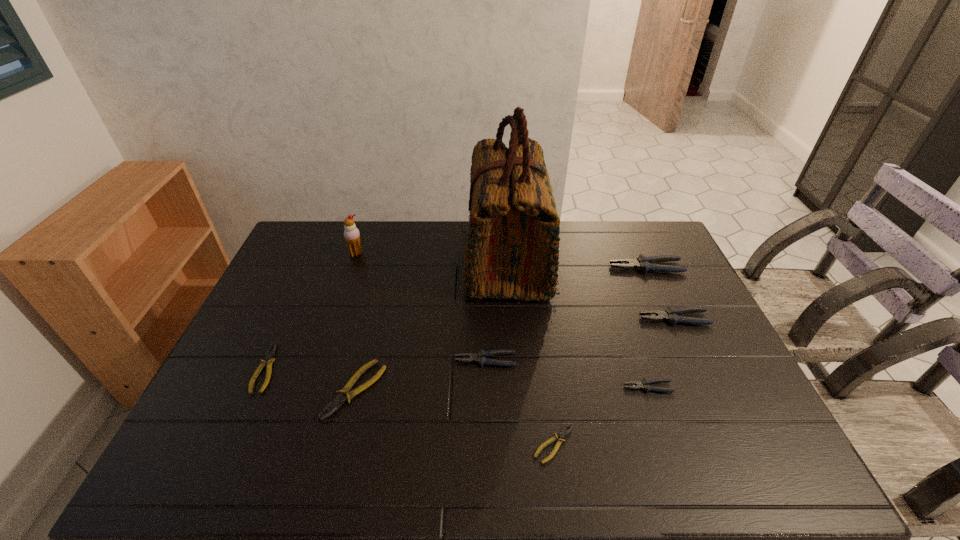
This screenshot has height=540, width=960. Identify the location of shopping bag. (512, 249).

Where is `the eighth shortest object`? The height and width of the screenshot is (540, 960). the eighth shortest object is located at coordinates (351, 234).

Locate an element on the screen. Image resolution: width=960 pixels, height=540 pixels. the eighth object from right to left is located at coordinates (351, 234).

Find the location of `the third tallest object`. the third tallest object is located at coordinates click(x=643, y=263).

At what (x,y) coordinates should I click in order to perform the action: click on the farthest pliers. Please return your answer as a coordinate pair (x, y). Image resolution: width=960 pixels, height=540 pixels. Looking at the image, I should click on (643, 263).

Where is `the sixth nearest object`? the sixth nearest object is located at coordinates (670, 314).

This screenshot has width=960, height=540. Find the location of `the second biggest gray pliers`. the second biggest gray pliers is located at coordinates (670, 314).

What are the coordinates of `the third farthest gray pliers` in the screenshot? It's located at (480, 357).

Identify the location of the leftmost gray pliers. Image resolution: width=960 pixels, height=540 pixels. (480, 357).

At what (x,y) coordinates should I click in order to perform the action: click on the biggest yellow pliers. Please return your answer as a coordinate pair (x, y). Looking at the image, I should click on (343, 395).